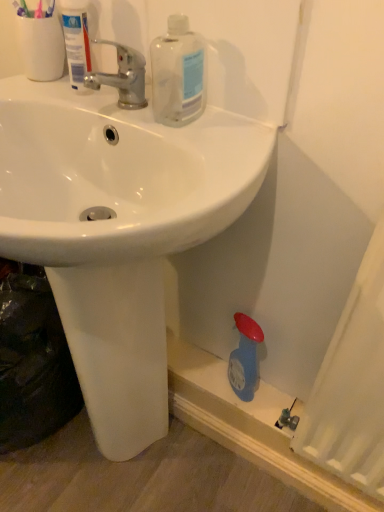
Question: From a real-world perspective, is chrome metallic faucet at upper center over white glossy sink at center?

Choices:
 (A) no
 (B) yes

Answer: (B)

Question: Considering the relative sizes of chrome metallic faucet at upper center and white glossy sink at center in the image provided, is chrome metallic faucet at upper center smaller than white glossy sink at center?

Choices:
 (A) no
 (B) yes

Answer: (B)

Question: Is chrome metallic faucet at upper center thinner than white glossy sink at center?

Choices:
 (A) yes
 (B) no

Answer: (A)

Question: Would you say chrome metallic faucet at upper center is outside white glossy sink at center?

Choices:
 (A) no
 (B) yes

Answer: (B)

Question: Is chrome metallic faucet at upper center turned away from white glossy sink at center?

Choices:
 (A) yes
 (B) no

Answer: (B)

Question: From the image's perspective, is chrome metallic faucet at upper center below white glossy sink at center?

Choices:
 (A) yes
 (B) no

Answer: (B)

Question: Does white glossy sink at center lie behind chrome metallic faucet at upper center?

Choices:
 (A) yes
 (B) no

Answer: (B)

Question: From a real-world perspective, is white glossy sink at center physically below chrome metallic faucet at upper center?

Choices:
 (A) yes
 (B) no

Answer: (A)

Question: Considering the relative positions of white glossy sink at center and chrome metallic faucet at upper center in the image provided, is white glossy sink at center to the right of chrome metallic faucet at upper center from the viewer's perspective?

Choices:
 (A) no
 (B) yes

Answer: (A)

Question: Is white glossy sink at center turned away from chrome metallic faucet at upper center?

Choices:
 (A) yes
 (B) no

Answer: (B)

Question: Does white glossy sink at center have a larger size compared to chrome metallic faucet at upper center?

Choices:
 (A) yes
 (B) no

Answer: (A)

Question: Can you confirm if white glossy sink at center is smaller than chrome metallic faucet at upper center?

Choices:
 (A) no
 (B) yes

Answer: (A)

Question: From the image's perspective, is white plastic tube at upper left above chrome metallic faucet at upper center?

Choices:
 (A) no
 (B) yes

Answer: (B)